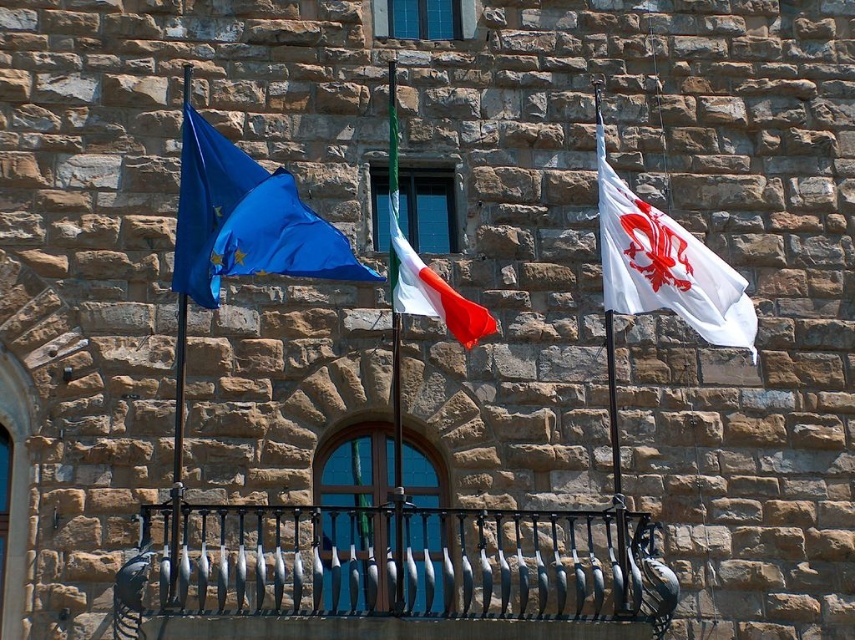
Who is more distant from viewer, (261,518) or (659,257)?

Point (659,257)

The height and width of the screenshot is (640, 855). I want to click on black wrought iron at center, so click(394, 564).

Which of these two, black wrought iron at center or white fabric flag at center, stands shorter?

With less height is black wrought iron at center.

The image size is (855, 640). I want to click on black wrought iron at center, so click(394, 564).

This screenshot has height=640, width=855. What are the coordinates of `black wrought iron at center` in the screenshot? It's located at (394, 564).

Identify the location of black wrought iron at center. This screenshot has width=855, height=640. (394, 564).

Is blue fabric flag at upper left thinner than white fabric flag at center?

Correct, blue fabric flag at upper left's width is less than white fabric flag at center's.

Does blue fabric flag at upper left lie behind white fabric flag at center?

No, it is in front of white fabric flag at center.

Is point (310, 257) closer to viewer compared to point (445, 298)?

Yes, point (310, 257) is closer to viewer.

Locate an element on the screen. The height and width of the screenshot is (640, 855). blue fabric flag at upper left is located at coordinates (245, 220).